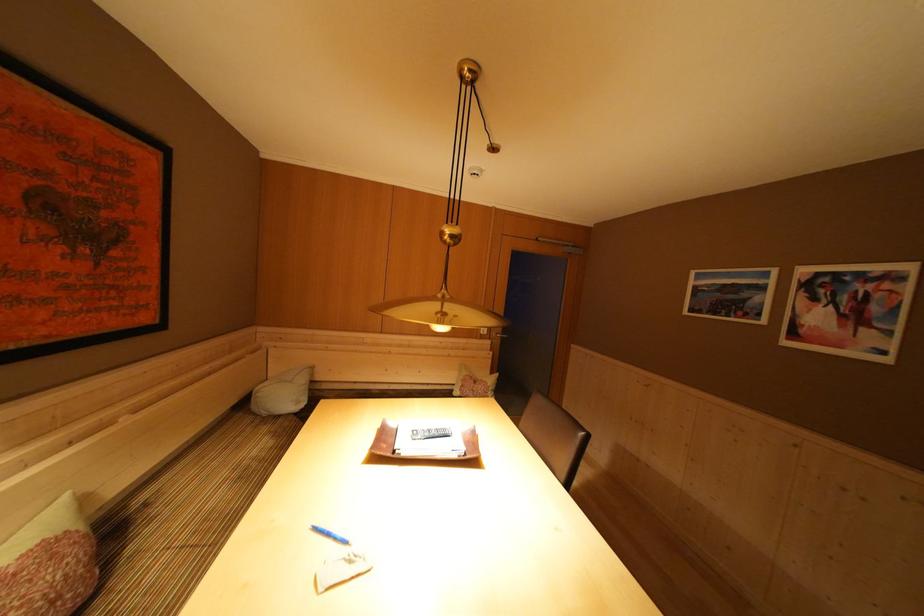
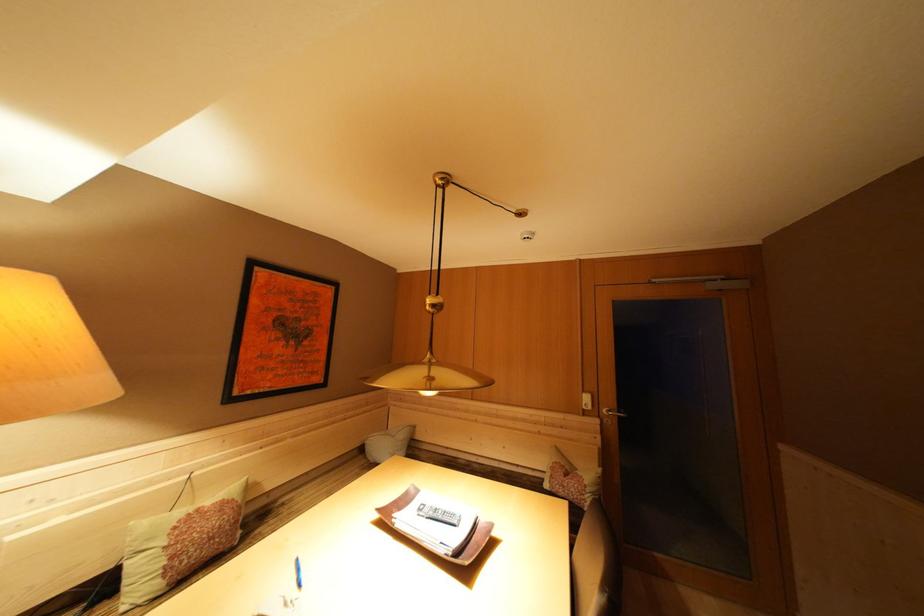
Where in the second image is the point corresponding to point (451, 305) from the first image?

(438, 369)